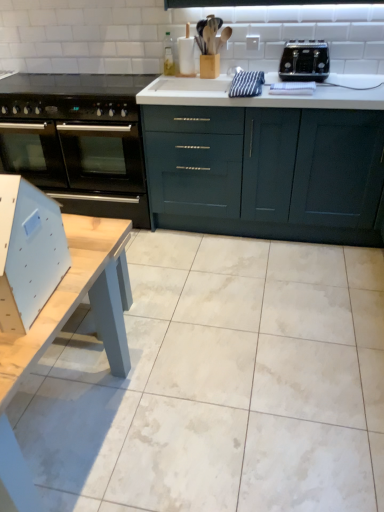
Question: From the image's perspective, is light wood table at lower left below black glass oven at left?

Choices:
 (A) yes
 (B) no

Answer: (A)

Question: Is light wood table at lower left in front of black glass oven at left?

Choices:
 (A) yes
 (B) no

Answer: (A)

Question: Could you tell me if light wood table at lower left is turned towards black glass oven at left?

Choices:
 (A) no
 (B) yes

Answer: (A)

Question: From a real-world perspective, is light wood table at lower left below black glass oven at left?

Choices:
 (A) no
 (B) yes

Answer: (A)

Question: Can you confirm if light wood table at lower left is thinner than black glass oven at left?

Choices:
 (A) no
 (B) yes

Answer: (A)

Question: Is light wood table at lower left oriented away from black glass oven at left?

Choices:
 (A) yes
 (B) no

Answer: (B)

Question: Would you say light wood table at lower left contains light blue plastic chair at lower left?

Choices:
 (A) yes
 (B) no

Answer: (B)

Question: Are light wood table at lower left and light blue plastic chair at lower left far apart?

Choices:
 (A) no
 (B) yes

Answer: (A)

Question: Is the depth of light wood table at lower left less than that of light blue plastic chair at lower left?

Choices:
 (A) no
 (B) yes

Answer: (B)

Question: From the image's perspective, would you say light wood table at lower left is shown under light blue plastic chair at lower left?

Choices:
 (A) yes
 (B) no

Answer: (A)

Question: From a real-world perspective, is light wood table at lower left under light blue plastic chair at lower left?

Choices:
 (A) no
 (B) yes

Answer: (B)

Question: From a real-world perspective, is light wood table at lower left over light blue plastic chair at lower left?

Choices:
 (A) yes
 (B) no

Answer: (B)

Question: Is black glass oven at left wider than black plastic toaster at upper right?

Choices:
 (A) no
 (B) yes

Answer: (B)